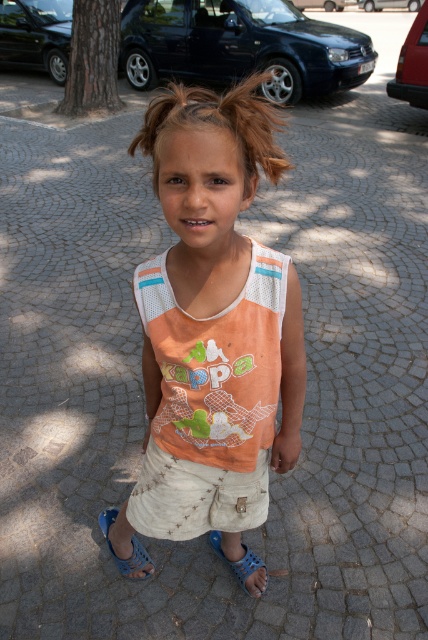
Question: Can you confirm if white cotton shorts at center is positioned to the right of light brown textured hair at center?

Choices:
 (A) no
 (B) yes

Answer: (A)

Question: Among these points, which one is farthest from the camera?

Choices:
 (A) 121,557
 (B) 223,524
 (C) 174,520
 (D) 246,552

Answer: (D)

Question: From the image, what is the correct spatial relationship of orange mesh tank top at center in relation to white cotton shorts at center?

Choices:
 (A) left
 (B) right

Answer: (A)

Question: Does white cotton shorts at center appear on the right side of blue rubber sandal at lower center?

Choices:
 (A) no
 (B) yes

Answer: (A)

Question: Estimate the real-world distances between objects in this image. Which object is closer to the blue rubber sandal at lower center?

Choices:
 (A) blue rubber sandal at lower left
 (B) orange mesh tank top at center
 (C) white cotton shorts at center
 (D) light brown textured hair at center

Answer: (A)

Question: Among these points, which one is farthest from the camera?

Choices:
 (A) (137, 545)
 (B) (226, 518)
 (C) (165, 525)

Answer: (A)